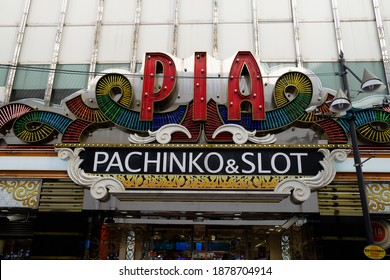
Find the location of a particular element. This screenshot has width=390, height=280. black wires is located at coordinates (70, 73).